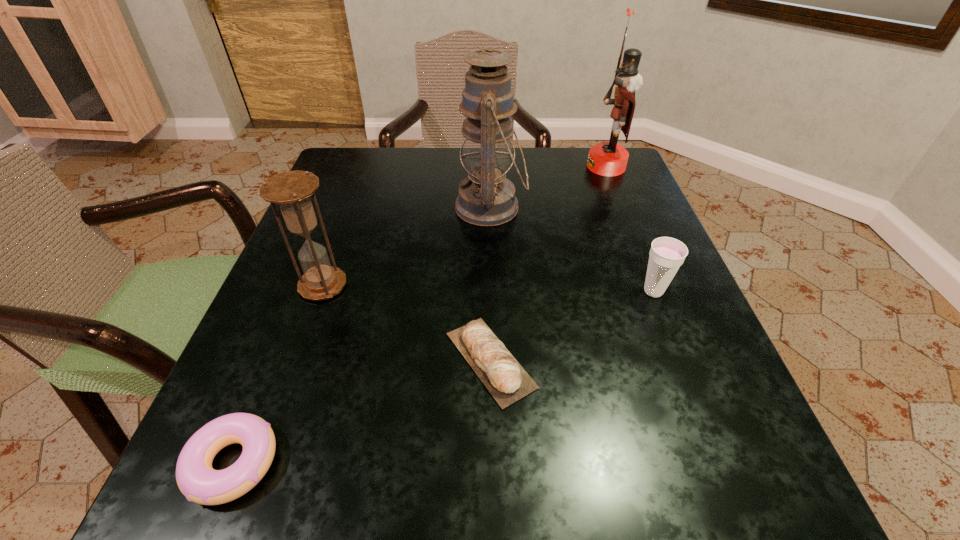
The height and width of the screenshot is (540, 960). What are the coordinates of `vacant region located 0.210m on the back of the fourth shortest object` in the screenshot? It's located at (352, 204).

The image size is (960, 540). Identify the location of vacant space located on the front of the cup. (708, 429).

Image resolution: width=960 pixels, height=540 pixels. I want to click on free space located on the front of the fifth farthest object, so click(x=493, y=502).

At what (x,y) coordinates should I click in order to perform the action: click on vacant space situated on the right of the nearest object. Please return your answer as a coordinate pair (x, y). The height and width of the screenshot is (540, 960). Looking at the image, I should click on (451, 463).

The height and width of the screenshot is (540, 960). I want to click on nutcracker located at the far edge, so click(x=606, y=158).

Image resolution: width=960 pixels, height=540 pixels. Identify the location of oil lamp that is at the far edge. (486, 197).

I want to click on object at the near edge, so click(x=197, y=480).

This screenshot has width=960, height=540. What are the coordinates of `hourglass present at the left edge` in the screenshot? It's located at (291, 190).

The width and height of the screenshot is (960, 540). In order to click on doughnut that is at the left edge in this screenshot , I will do `click(197, 480)`.

Locate an element on the screen. nutcracker present at the right edge is located at coordinates (606, 158).